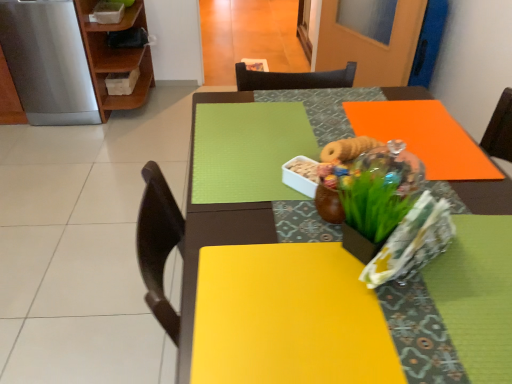
Where is `vacant area that lies to the right of wooden shelf at upper left`? The height and width of the screenshot is (384, 512). vacant area that lies to the right of wooden shelf at upper left is located at coordinates (168, 102).